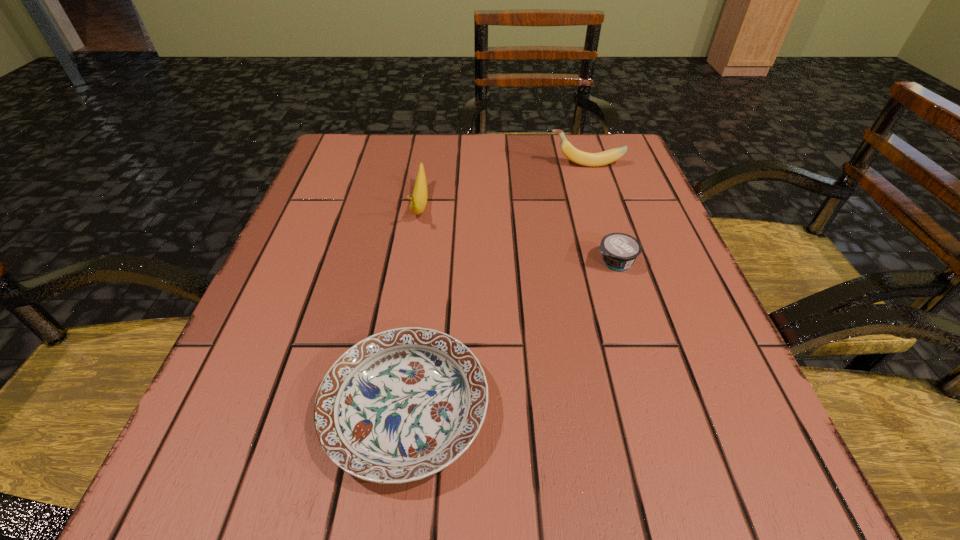
Where is `vacant space that satisfies the following two spatial constraints: 1. at the stem of the farther banana; 2. on the front side of the yogurt`? The image size is (960, 540). vacant space that satisfies the following two spatial constraints: 1. at the stem of the farther banana; 2. on the front side of the yogurt is located at coordinates (616, 262).

At what (x,y) coordinates should I click in order to perform the action: click on free point that satisfies the following two spatial constraints: 1. at the stem of the second nearest object; 2. on the left side of the left banana. Please return your answer as a coordinate pair (x, y). Looking at the image, I should click on (411, 262).

The width and height of the screenshot is (960, 540). Find the location of `blank area in the image that satisfies the following two spatial constraints: 1. at the stem of the nearer banana; 2. on the right side of the nearest object`. blank area in the image that satisfies the following two spatial constraints: 1. at the stem of the nearer banana; 2. on the right side of the nearest object is located at coordinates (387, 409).